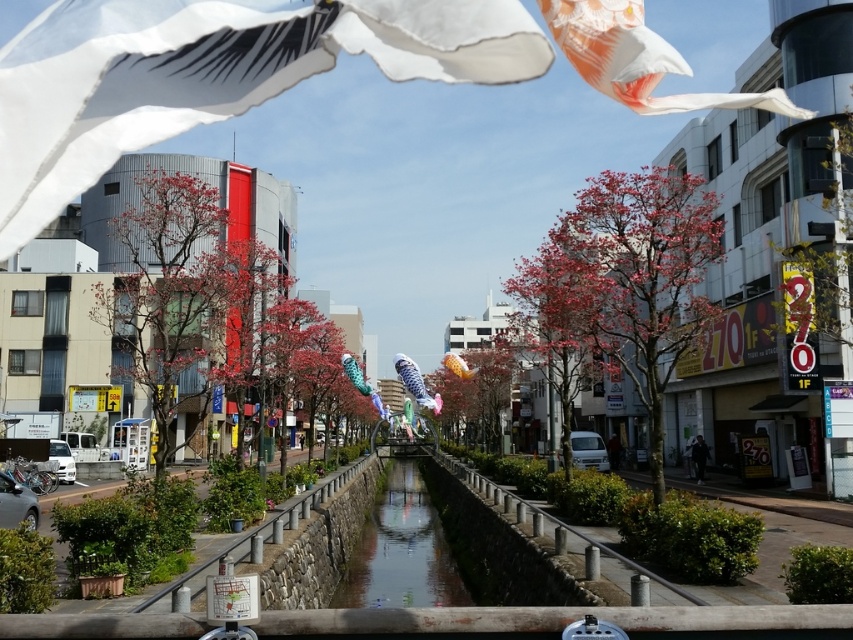
Question: Which of these objects is positioned farthest from the clear glass waterway at center?

Choices:
 (A) blue fabric kite at center
 (B) white fabric kite at upper center
 (C) yellow fabric kite at center

Answer: (B)

Question: Does white fabric kite at upper center appear on the left side of clear glass waterway at center?

Choices:
 (A) no
 (B) yes

Answer: (A)

Question: Can you confirm if blue fabric kite at center is positioned above yellow fabric kite at center?

Choices:
 (A) no
 (B) yes

Answer: (A)

Question: Which object is farther from the camera taking this photo?

Choices:
 (A) white fabric kite at upper center
 (B) white paper kite at upper right
 (C) blue fabric kite at center

Answer: (C)

Question: Estimate the real-world distances between objects in this image. Which object is closer to the clear glass waterway at center?

Choices:
 (A) white paper kite at upper right
 (B) white fabric kite at upper center
 (C) yellow fabric kite at center

Answer: (C)

Question: Is clear glass waterway at center in front of yellow fabric kite at center?

Choices:
 (A) no
 (B) yes

Answer: (B)